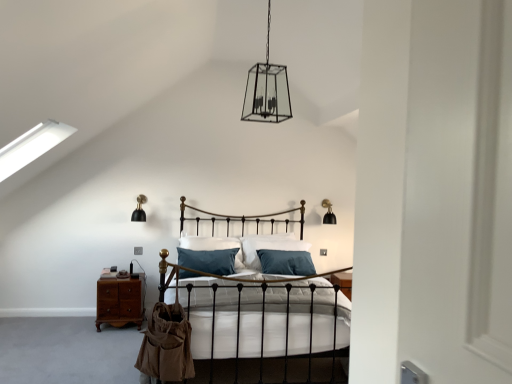
Question: Is mahogany wood nightstand at lower left to the left or to the right of clear glass lantern at center, placed as the 1th light fixture when sorted from top to bottom, in the image?

Choices:
 (A) right
 (B) left

Answer: (B)

Question: From a real-world perspective, is mahogany wood nightstand at lower left above or below clear glass lantern at center, which is the first light fixture from front to back?

Choices:
 (A) below
 (B) above

Answer: (A)

Question: Estimate the real-world distances between objects in this image. Which object is closer to the mahogany wood nightstand at lower left?

Choices:
 (A) matte black bed at center
 (B) black matte wall sconce at upper right, marked as the third light fixture in a left-to-right arrangement
 (C) black matte wall sconce at left, the 3th light fixture from the right
 (D) teal fabric pillow at center
 (E) clear glass lantern at center, placed as the 1th light fixture when sorted from top to bottom

Answer: (D)

Question: Which of these objects is positioned farthest from the mahogany wood nightstand at lower left?

Choices:
 (A) teal fabric pillow at center
 (B) black matte wall sconce at left, the second light fixture in the front-to-back sequence
 (C) black matte wall sconce at upper right, the 1th light fixture in the right-to-left sequence
 (D) clear glass lantern at center, the 3th light fixture ordered from the bottom
 (E) matte black bed at center

Answer: (D)